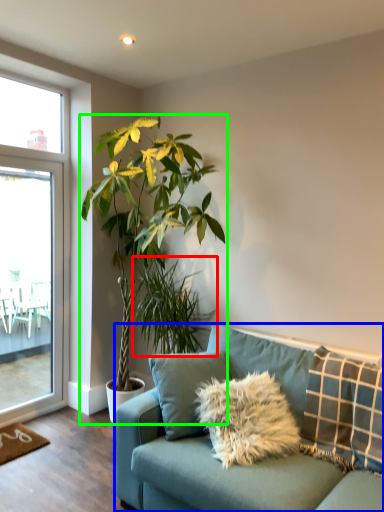
Question: Based on their relative distances, which object is nearer to houseplant (highlighted by a red box)? Choose from studio couch (highlighted by a blue box) and houseplant (highlighted by a green box).

Choices:
 (A) studio couch
 (B) houseplant

Answer: (B)